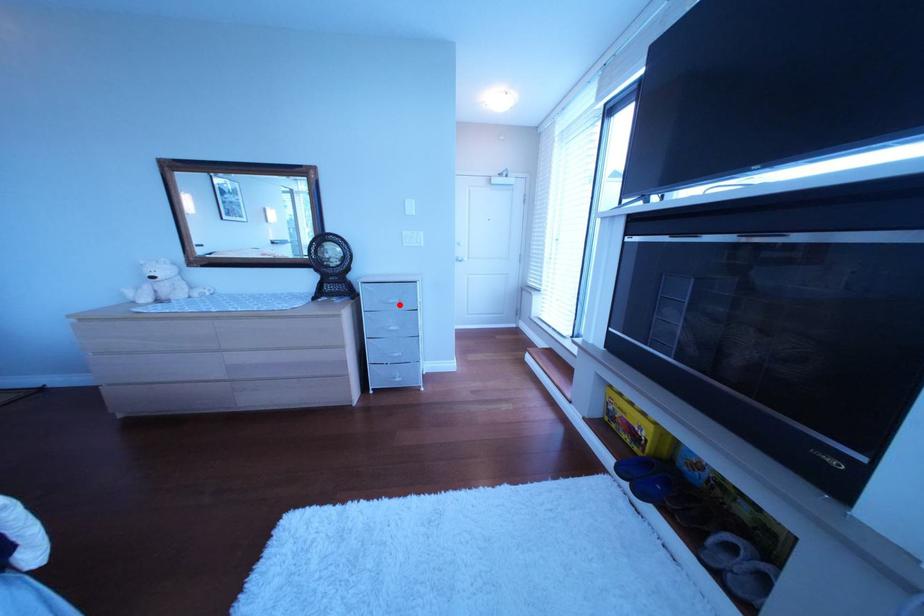
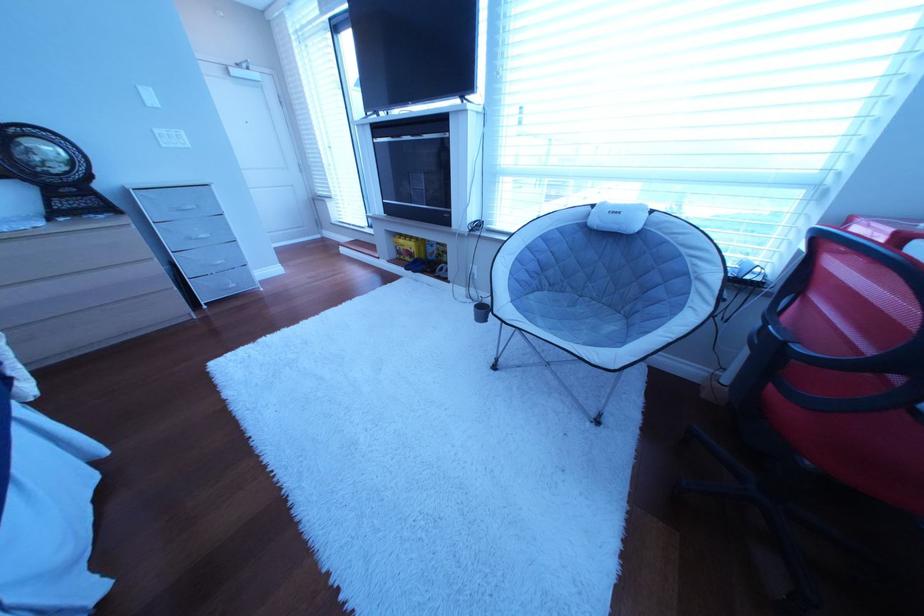
Where in the second image is the point corresponding to the highlighted location from the first image?

(193, 213)